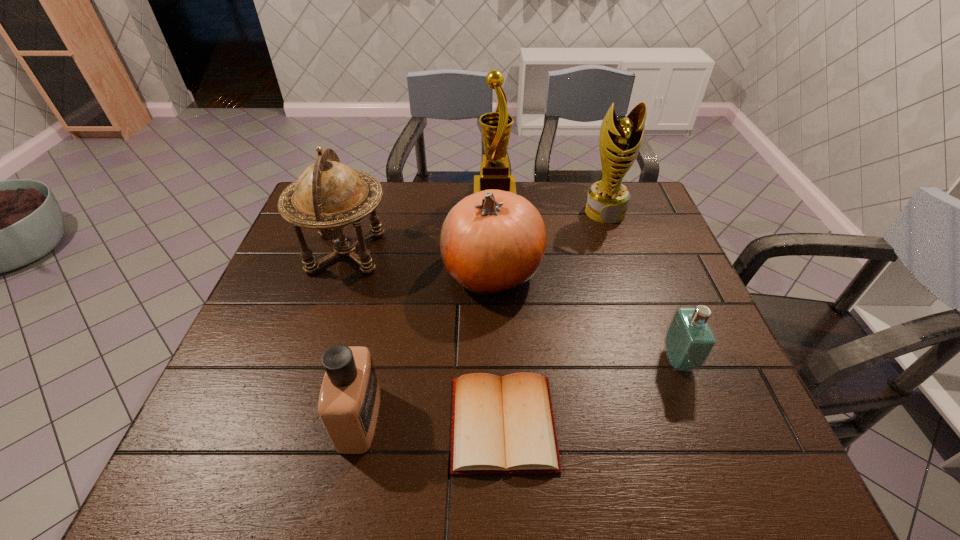
In the image, there is a desktop. At what (x,y) coordinates should I click in order to perform the action: click on vacant space at the near left corner. Please return your answer as a coordinate pair (x, y). Looking at the image, I should click on (210, 446).

Locate an element on the screen. Image resolution: width=960 pixels, height=540 pixels. vacant space at the near right corner is located at coordinates (726, 444).

Locate an element on the screen. This screenshot has height=540, width=960. unoccupied position between the left award and the right award is located at coordinates (549, 203).

Find the location of a particular element. free space between the pumpkin and the globe is located at coordinates (420, 261).

Locate an element on the screen. Image resolution: width=960 pixels, height=540 pixels. unoccupied position between the Bible and the pumpkin is located at coordinates (497, 347).

Locate an element on the screen. The width and height of the screenshot is (960, 540). vacant area that lies between the pumpkin and the sixth tallest object is located at coordinates (586, 315).

At what (x,y) coordinates should I click in order to perform the action: click on unoccupied position between the Bible and the right award. Please return your answer as a coordinate pair (x, y). Looking at the image, I should click on (554, 318).

Identify the location of free area in between the globe and the left award. This screenshot has height=540, width=960. (420, 223).

Locate an element on the screen. This screenshot has height=540, width=960. free spot between the Bible and the left award is located at coordinates click(498, 309).

Find the location of a particular element. The height and width of the screenshot is (540, 960). free space that is in between the fourth shortest object and the right award is located at coordinates [x=548, y=241].